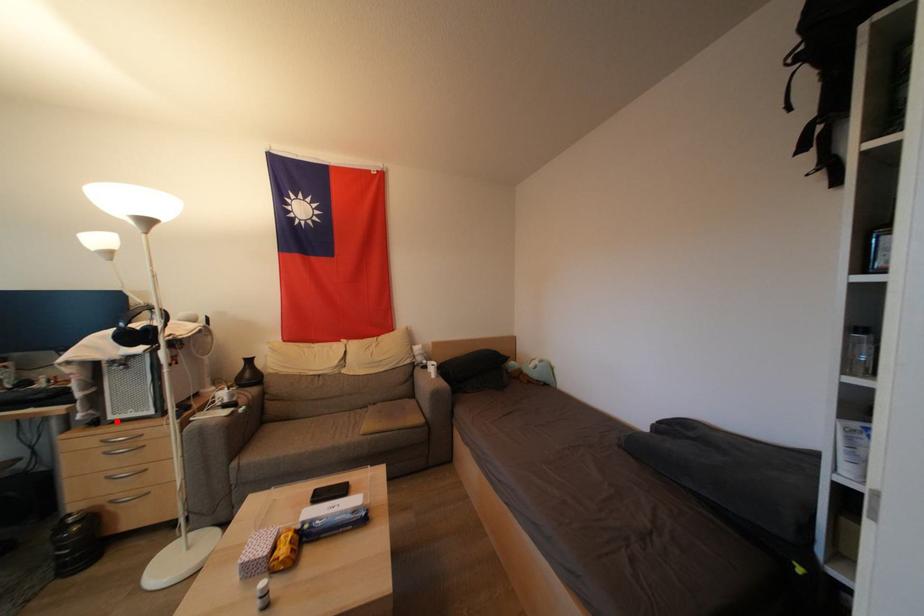
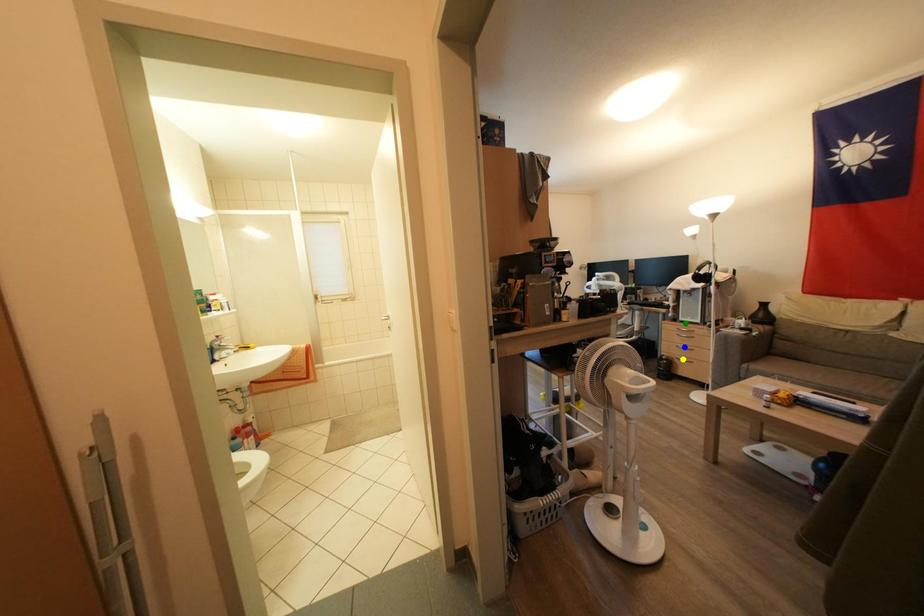
Question: I am providing you with two images of the same scene from different viewpoints. A red point is marked on the first image. You are given multiple points on the second image. Which mark in image 2 goes with the point in image 1?

Choices:
 (A) yellow point
 (B) green point
 (C) blue point

Answer: (B)